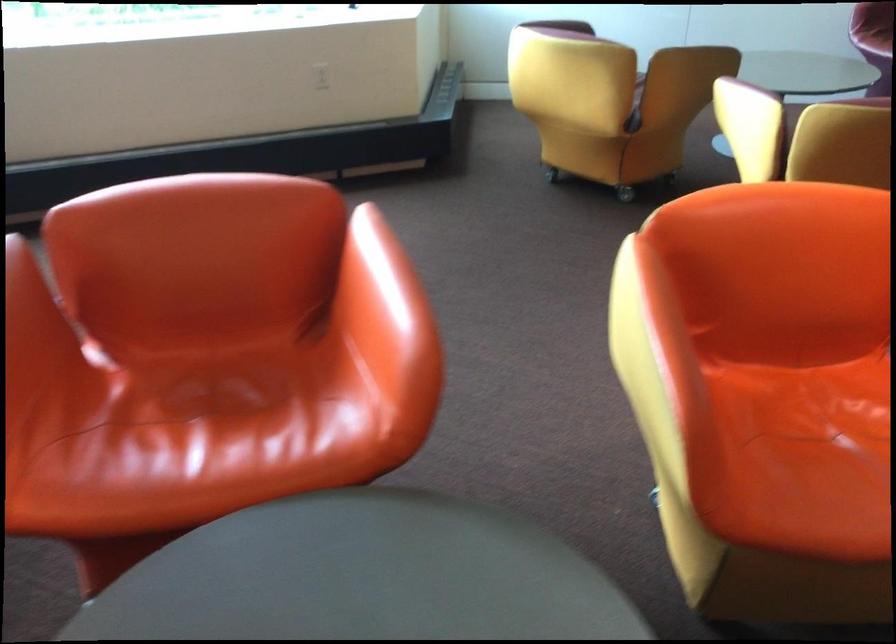
What are the coordinates of `yellow chair armrest` in the screenshot? It's located at (754, 87).